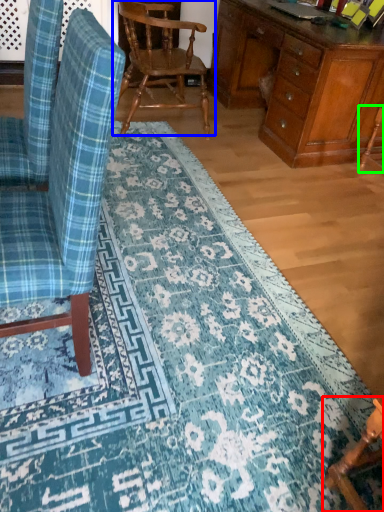
Question: Considering the real-world distances, which object is closest to chair (highlighted by a red box)? chair (highlighted by a blue box) or armchair (highlighted by a green box).

Choices:
 (A) chair
 (B) armchair

Answer: (B)